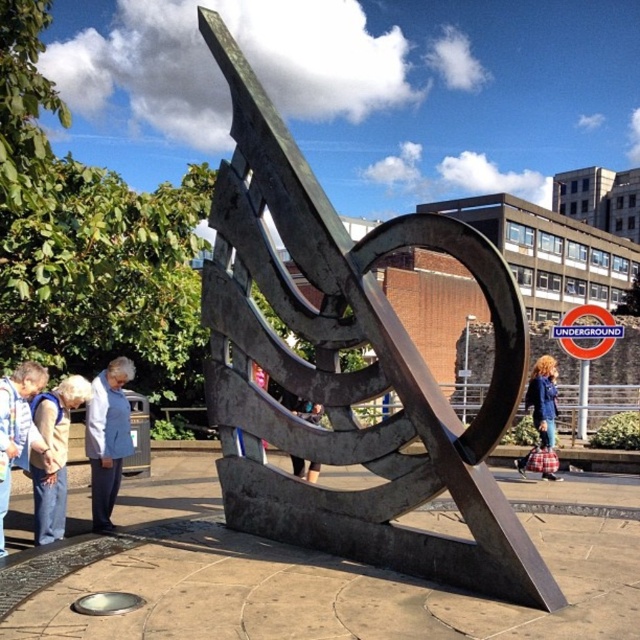
Question: Among these objects, which one is nearest to the camera?

Choices:
 (A) light blue fabric jacket at lower left
 (B) light beige fabric at lower left
 (C) blue denim jacket at center
 (D) dark brown leather jacket at center

Answer: (B)

Question: Which point is farther to the camera?

Choices:
 (A) (10, 490)
 (B) (330, 492)

Answer: (A)

Question: Can you confirm if polished bronze sculpture at center is positioned above light blue fabric jacket at lower left?

Choices:
 (A) no
 (B) yes

Answer: (B)

Question: Does polished bronze sculpture at center appear on the right side of dark brown leather jacket at center?

Choices:
 (A) no
 (B) yes

Answer: (B)

Question: Which of the following is the farthest from the observer?

Choices:
 (A) dark brown leather jacket at center
 (B) light blue fabric jacket at lower left
 (C) blue denim jacket at center

Answer: (C)

Question: Can you confirm if light blue denim jacket at lower left is positioned to the right of blue denim jacket at center?

Choices:
 (A) yes
 (B) no

Answer: (B)